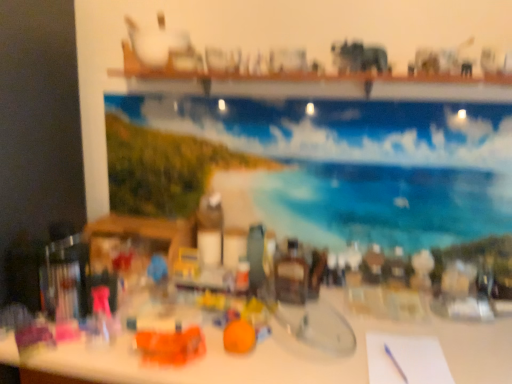
Locate an element on the screen. The height and width of the screenshot is (384, 512). free space to the left of orange matte toy at center, which is the 2th toy from left to right is located at coordinates (199, 359).